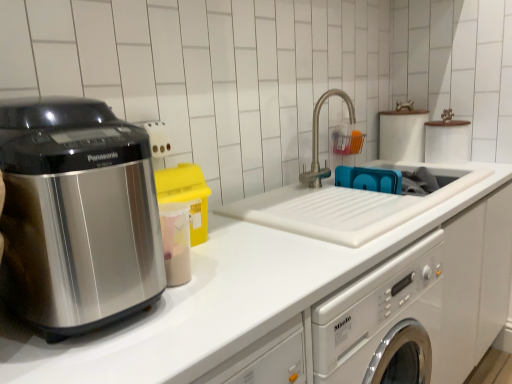
Question: Does point (316, 185) appear closer or farther from the camera than point (34, 165)?

Choices:
 (A) farther
 (B) closer

Answer: (A)

Question: Do you think brushed metal faucet at center is within satin metallic appliance at left, or outside of it?

Choices:
 (A) inside
 (B) outside

Answer: (B)

Question: Estimate the real-world distances between objects in this image. Which object is closer to the brushed metal faucet at center?

Choices:
 (A) satin metallic appliance at left
 (B) white matte countertop at center

Answer: (B)

Question: Based on their relative distances, which object is nearer to the brushed metal faucet at center?

Choices:
 (A) white matte countertop at center
 (B) satin metallic appliance at left

Answer: (A)